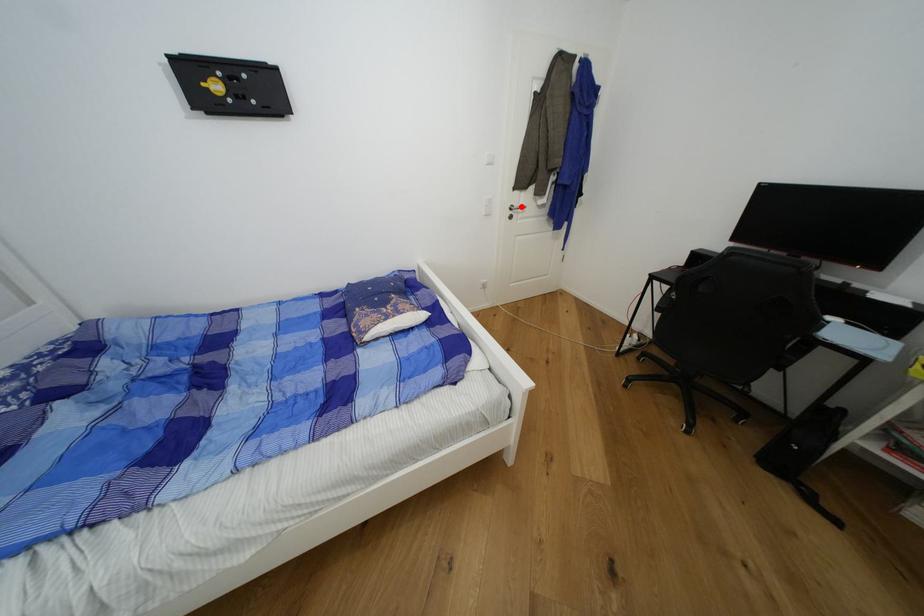
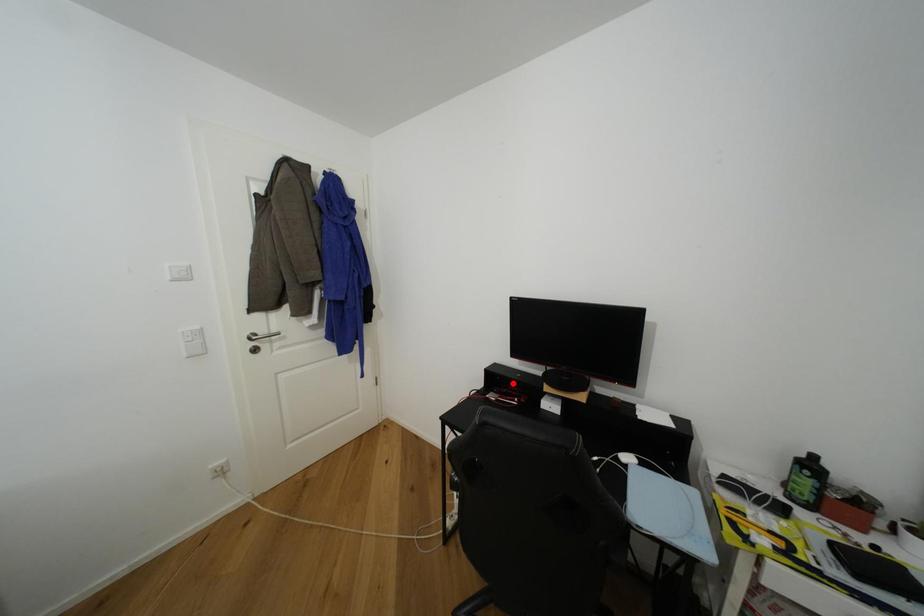
I am providing you with two images of the same scene from different viewpoints. A red point is marked on the first image and another point is marked on the second image. Is the marked point in image1 the same physical position as the marked point in image2?

No